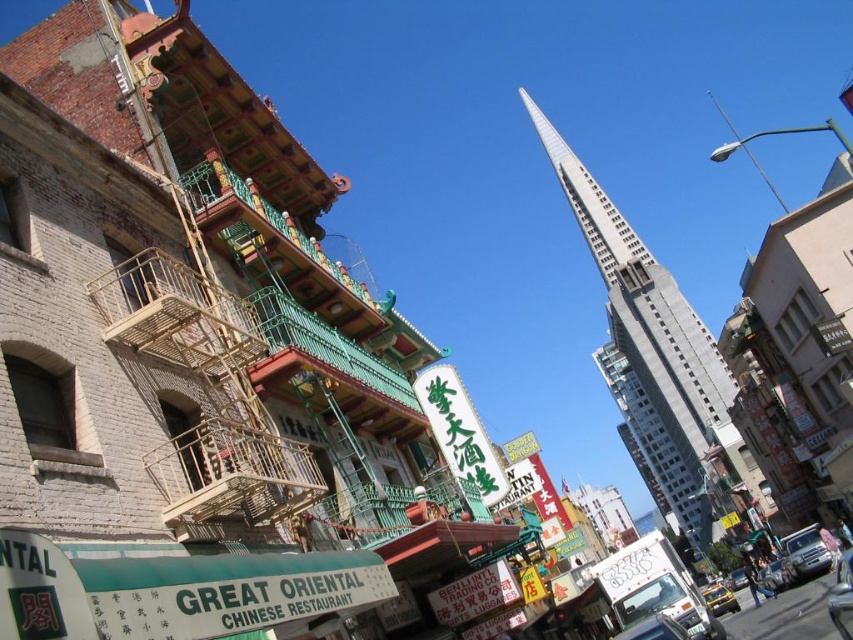
Question: Which of the following is the farthest from the observer?

Choices:
 (A) metallic silver car at center
 (B) silver metallic car at lower right
 (C) gray concrete tower at center

Answer: (C)

Question: Can you confirm if gray concrete tower at center is wider than metallic silver car at center?

Choices:
 (A) yes
 (B) no

Answer: (A)

Question: In this image, where is silver metallic car at lower right located relative to yellow matte taxi at lower right?

Choices:
 (A) below
 (B) above

Answer: (B)

Question: Which object appears farthest from the camera in this image?

Choices:
 (A) gray concrete tower at center
 (B) yellow matte taxi at lower right
 (C) silver metallic car at lower right

Answer: (A)

Question: Estimate the real-world distances between objects in this image. Which object is closer to the silver metallic car at lower right?

Choices:
 (A) metallic silver car at center
 (B) yellow matte taxi at lower right
 (C) gray concrete tower at center

Answer: (B)

Question: Is gray concrete tower at center above yellow matte taxi at lower right?

Choices:
 (A) yes
 (B) no

Answer: (A)